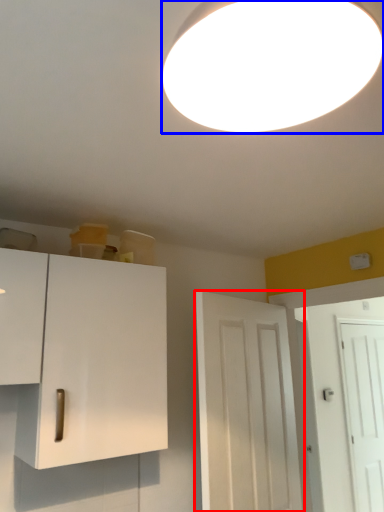
Question: Among these objects, which one is farthest to the camera, door (highlighted by a red box) or lamp (highlighted by a blue box)?

Choices:
 (A) door
 (B) lamp

Answer: (A)